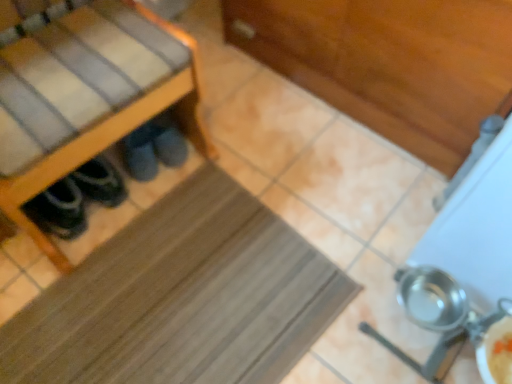
Locate an element on the screen. free location to the right of dark gray suede slippers at lower left is located at coordinates (227, 144).